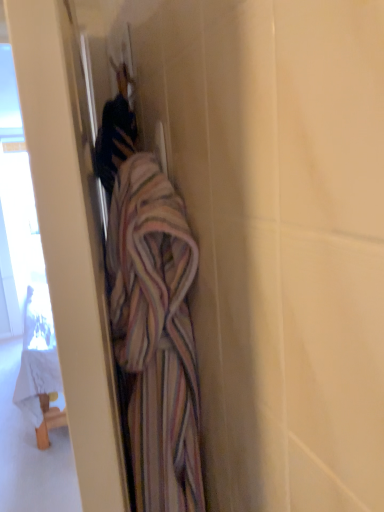
What is the approximate width of striped fabric at center?

striped fabric at center is 4.46 inches wide.

What do you see at coordinates (156, 334) in the screenshot?
I see `striped fabric at center` at bounding box center [156, 334].

The height and width of the screenshot is (512, 384). What are the coordinates of `striped fabric at center` in the screenshot? It's located at (156, 334).

Where is `striped fabric at center`? striped fabric at center is located at coordinates (156, 334).